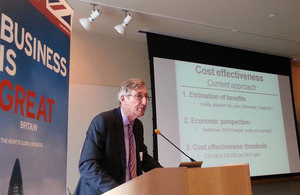
At what (x,y) coordinates should I click in order to perform the action: click on screen. Please return your answer as a coordinate pair (x, y). The height and width of the screenshot is (195, 300). Looking at the image, I should click on (216, 73).